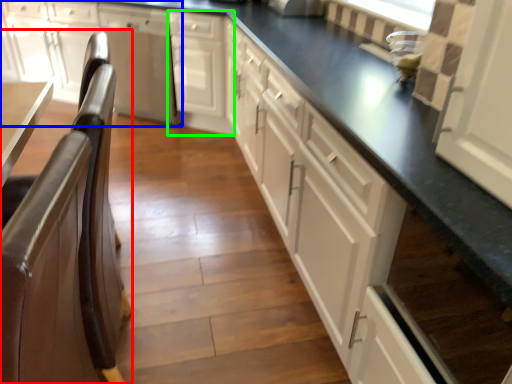
Question: Estimate the real-world distances between objects in this image. Which object is closer to chair (highlighted by a red box), cabinetry (highlighted by a blue box) or cabinetry (highlighted by a green box)?

Choices:
 (A) cabinetry
 (B) cabinetry

Answer: (B)